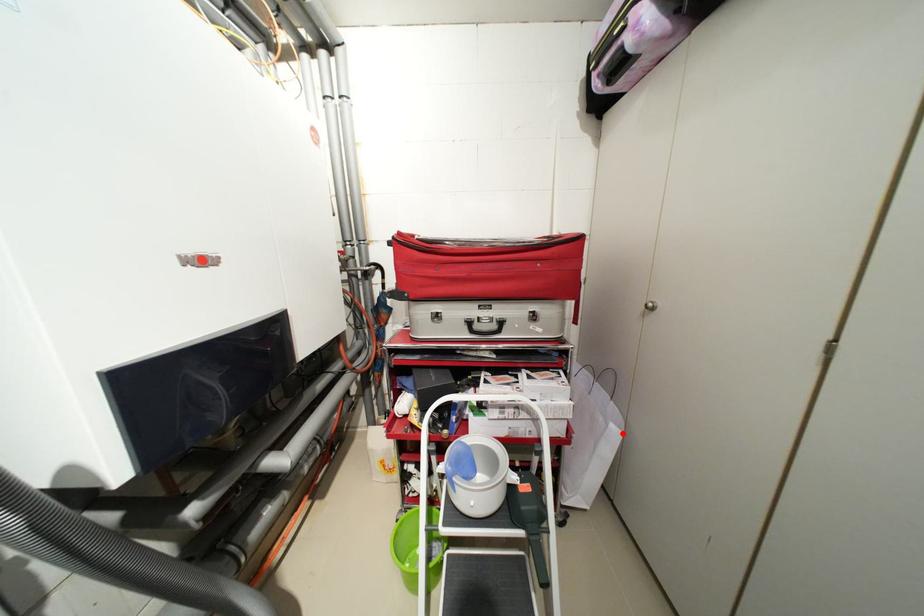
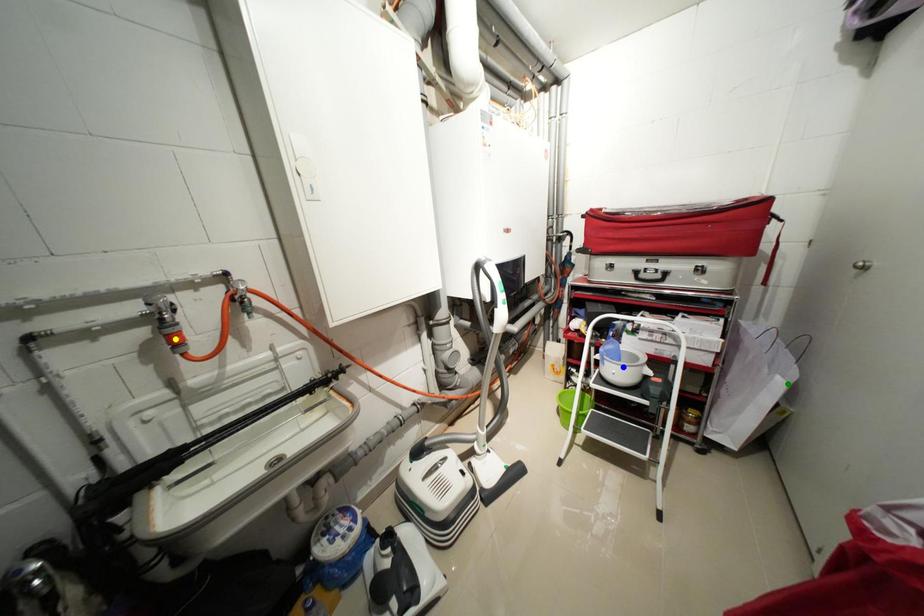
Question: I am providing you with two images of the same scene from different viewpoints. A red point is marked on the first image. You are given multiple points on the second image. Can you choose the point in image 2 that corresponds to the point in image 1?

Choices:
 (A) green point
 (B) blue point
 (C) yellow point

Answer: (A)